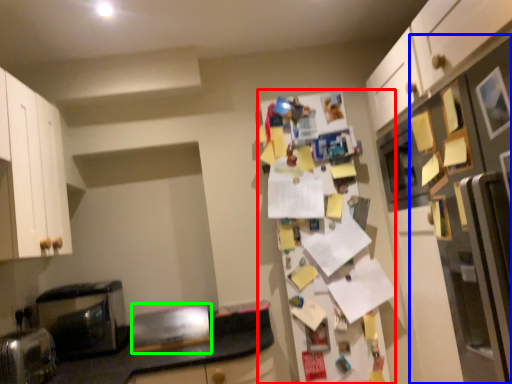
Question: Which is nearer to the fridge (highlighted by a red box)? fridge (highlighted by a blue box) or appliance (highlighted by a green box).

Choices:
 (A) fridge
 (B) appliance

Answer: (B)